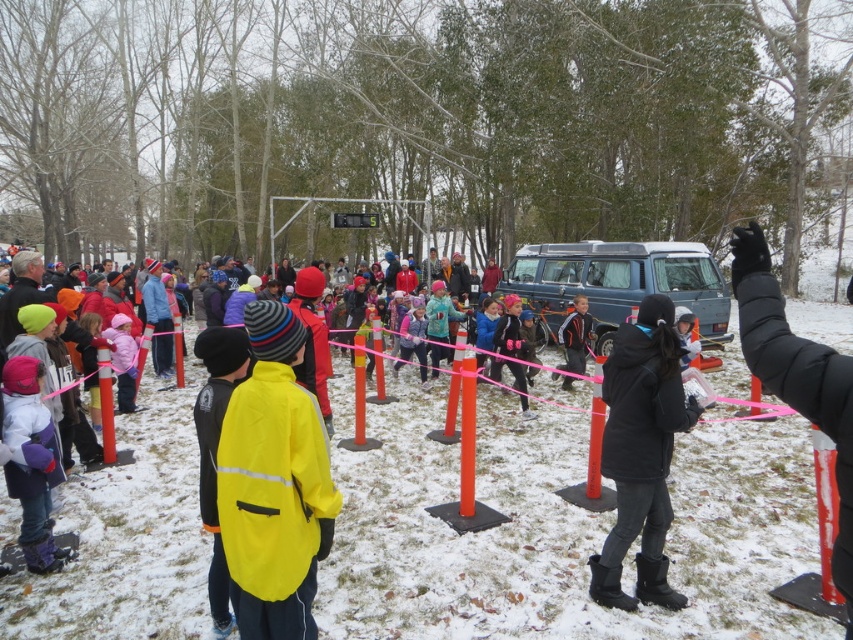
You are a photographer trying to capture the children participating in the winter activity. You notice a pink ribbon and a black puffy glove with a point at coordinates (798, 380). Which object is closer to the camera?

The point at coordinates (798, 380) is on the black puffy glove at upper right, so the black puffy glove at upper right is closer to the camera than the pink ribbon.

You are a photographer standing at the edge of the snowy field. You want to capture a photo that includes both the black matte jacket at lower right and the blue metallic van at center. However, your camera has a limited field of view. Which object should you position closer to the center of the frame to ensure both are visible without zooming?

→ Since the black matte jacket at lower right is wider than the blue metallic van at center, you should position the black matte jacket at lower right closer to the center of the frame. This will allow both objects to fit within the camera view without needing to zoom.

You are a participant in the winter race and need to reach the starting line marked by the pink ribbon. There is a blue metallic van at center in your path. Based on its position, can you estimate whether the van is blocking your direct path to the ribbon?

The blue metallic van at center is located at point (619,282), which likely blocks the direct path to the starting line marked by the pink ribbon since it is centrally positioned.